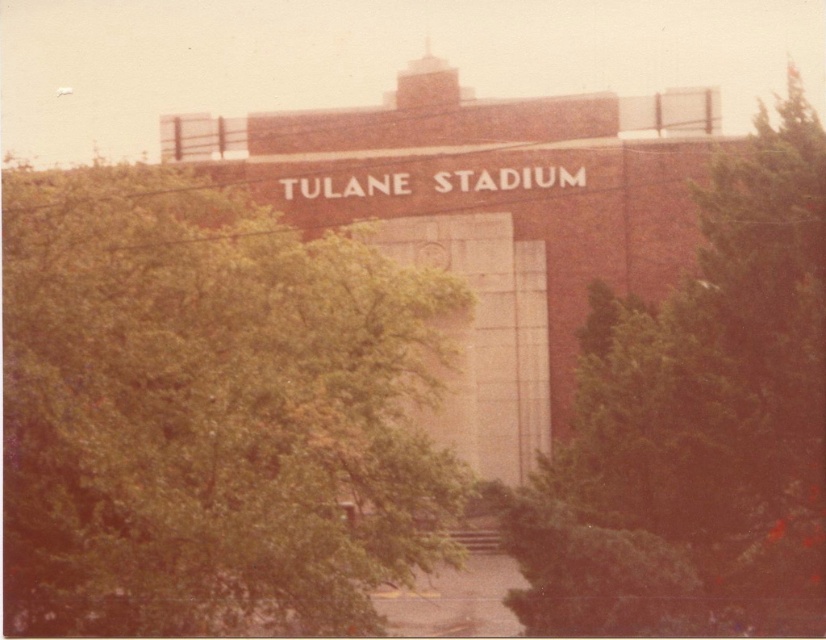
Question: Is green leafy tree at center positioned in front of green leafy tree at right?

Choices:
 (A) yes
 (B) no

Answer: (A)

Question: Is the position of green leafy tree at center more distant than that of green leafy tree at right?

Choices:
 (A) no
 (B) yes

Answer: (A)

Question: Which object is farther from the camera taking this photo?

Choices:
 (A) green leafy tree at center
 (B) green leafy tree at right

Answer: (B)

Question: Where is green leafy tree at center located in relation to green leafy tree at right in the image?

Choices:
 (A) below
 (B) above

Answer: (A)

Question: Among these points, which one is farthest from the camera?

Choices:
 (A) (374, 552)
 (B) (715, 419)

Answer: (A)